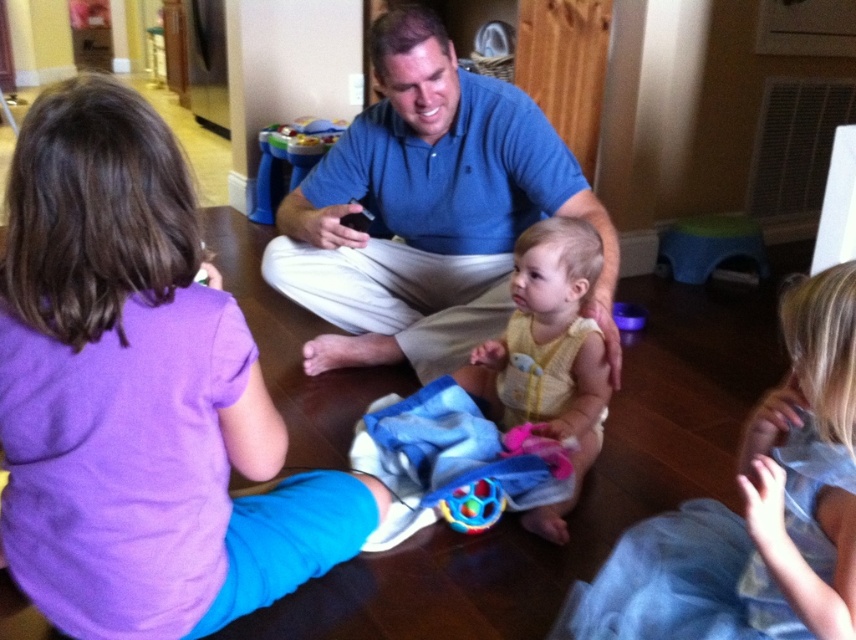
You are a delivery person who needs to place a 24 inch long package between the purple cotton shirt at left and the yellow knitted vest at center. Can the package fit in the space between them?

The distance between the purple cotton shirt at left and the yellow knitted vest at center is 26.35 inches. Since the package is 24 inches long, there is enough space to place it between them.

You are a photographer trying to capture a candid shot of the blue cotton shirt at center and the light yellow knit sweater at lower right. Since you want both subjects in the frame, can you position yourself so that you can see both at the same time?

Yes, because the blue cotton shirt at center is to the left of the light yellow knit sweater at lower right, positioning yourself between them or slightly to the side would allow you to capture both in the frame.